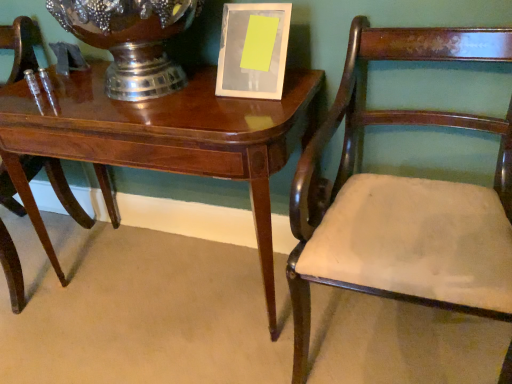
Image resolution: width=512 pixels, height=384 pixels. Identify the location of vacant point above white glossy picture frame at upper center (from a real-world perspective). (254, 1).